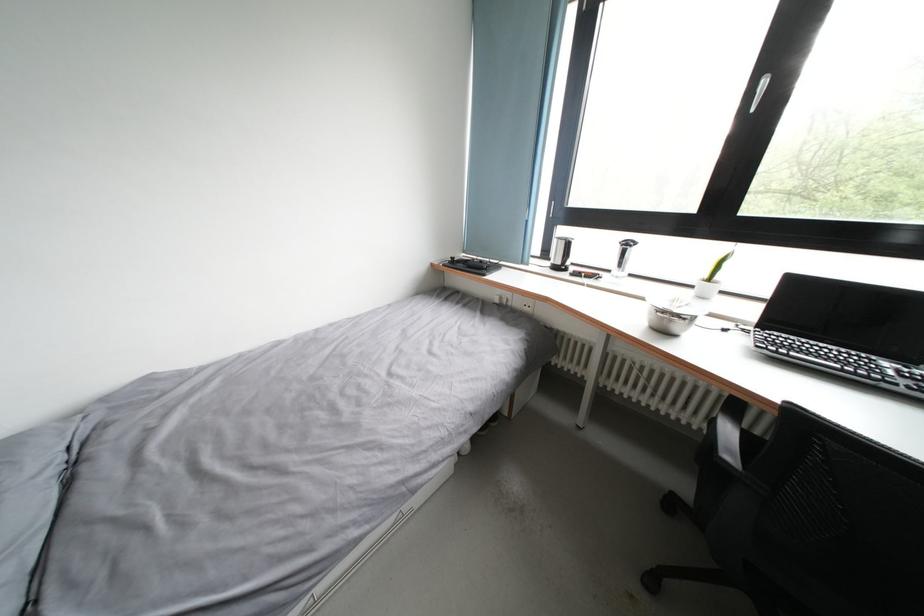
Identify the location of silver lid handle. This screenshot has width=924, height=616. (622, 254).